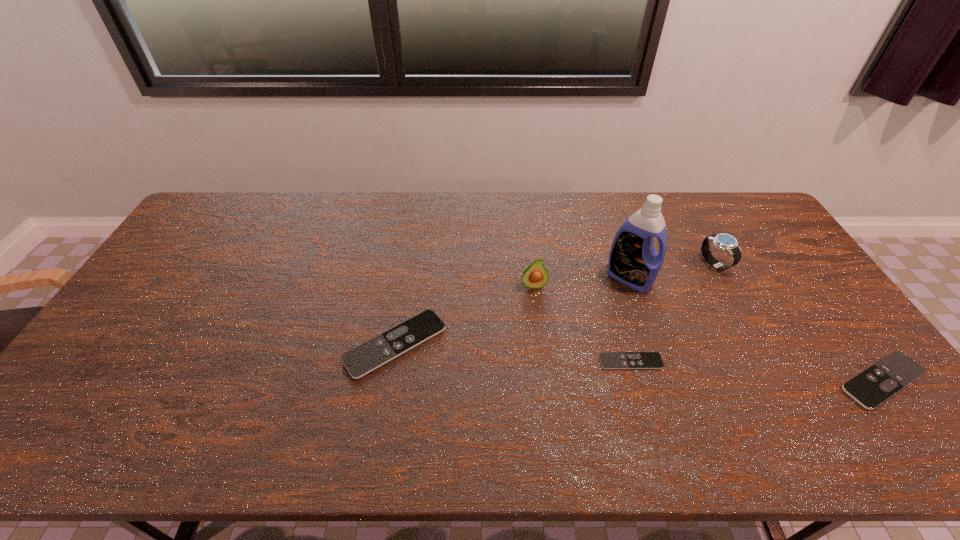
I want to click on the leftmost remote control, so click(365, 358).

This screenshot has height=540, width=960. Identify the location of the shortest object. (609, 360).

Locate an element on the screen. the second remote control from right to left is located at coordinates (609, 360).

The image size is (960, 540). I want to click on the rightmost object, so click(x=875, y=385).

This screenshot has height=540, width=960. I want to click on the rightmost remote control, so click(x=875, y=385).

I want to click on the tallest object, so click(x=633, y=261).

Identify the location of watch. (725, 242).

Image resolution: width=960 pixels, height=540 pixels. Find the location of `the second object from right to left`. the second object from right to left is located at coordinates (725, 242).

Identify the location of avocado. (535, 276).

This screenshot has height=540, width=960. In order to click on the fifth shortest object in this screenshot , I will do `click(535, 276)`.